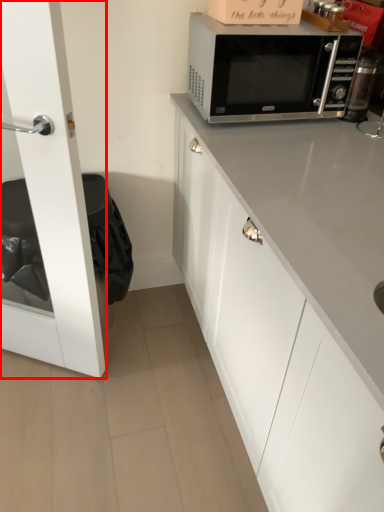
Question: Where is glass door (annotated by the red box) located in relation to microwave oven in the image?

Choices:
 (A) left
 (B) right

Answer: (A)